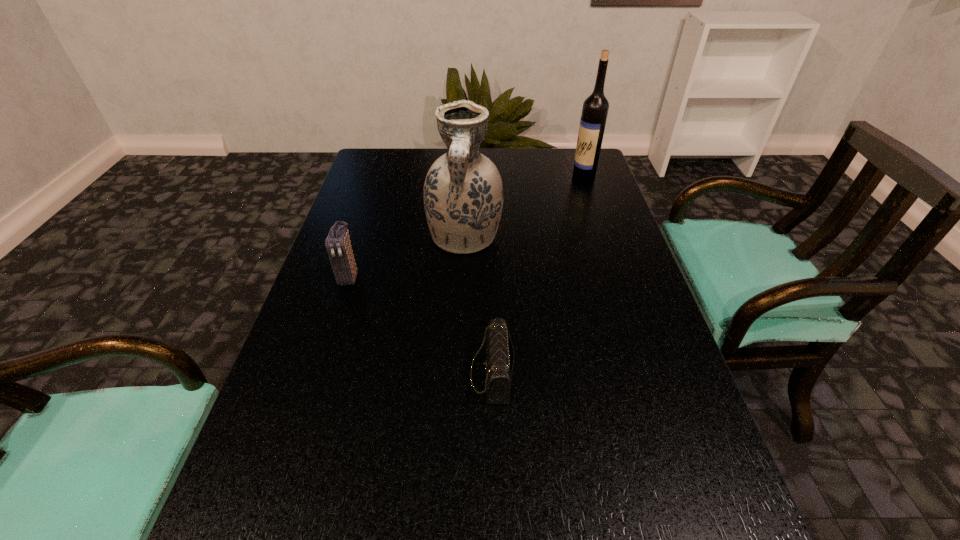
Locate an element on the screen. blank space at the right edge of the desktop is located at coordinates (653, 506).

I want to click on free point between the shorter clutch bag and the left clutch bag, so click(x=420, y=326).

The width and height of the screenshot is (960, 540). What are the coordinates of `vacant area between the right clutch bag and the second shortest object` in the screenshot? It's located at (420, 326).

Where is `vacant area that lies between the rightmost object and the nearer clutch bag`? vacant area that lies between the rightmost object and the nearer clutch bag is located at coordinates (538, 275).

This screenshot has width=960, height=540. What are the coordinates of `free spot between the shorter clutch bag and the vase` in the screenshot? It's located at (478, 306).

At what (x,y) coordinates should I click in order to perform the action: click on free space that is in between the vase and the farthest object. Please return your answer as a coordinate pair (x, y). The height and width of the screenshot is (540, 960). Looking at the image, I should click on (524, 207).

Locate an element on the screen. The width and height of the screenshot is (960, 540). vacant space in between the farthest object and the shorter clutch bag is located at coordinates (538, 275).

Find the location of `vacant space in between the left clutch bag and the vase`. vacant space in between the left clutch bag and the vase is located at coordinates (407, 258).

In order to click on vacant region between the leftmost object and the vase in this screenshot , I will do `click(407, 258)`.

What are the coordinates of `object that can be found as the third closest to the rightmost object` in the screenshot? It's located at (338, 243).